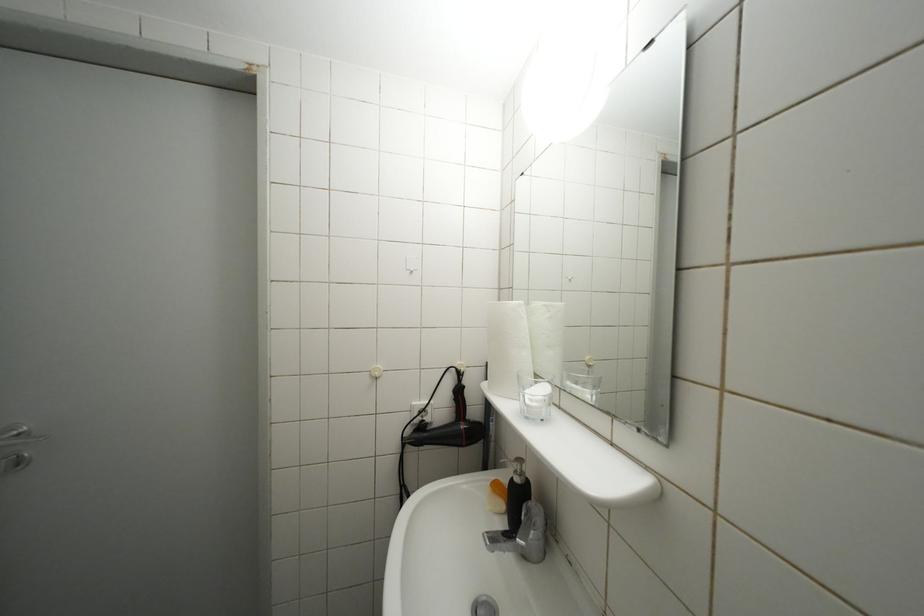
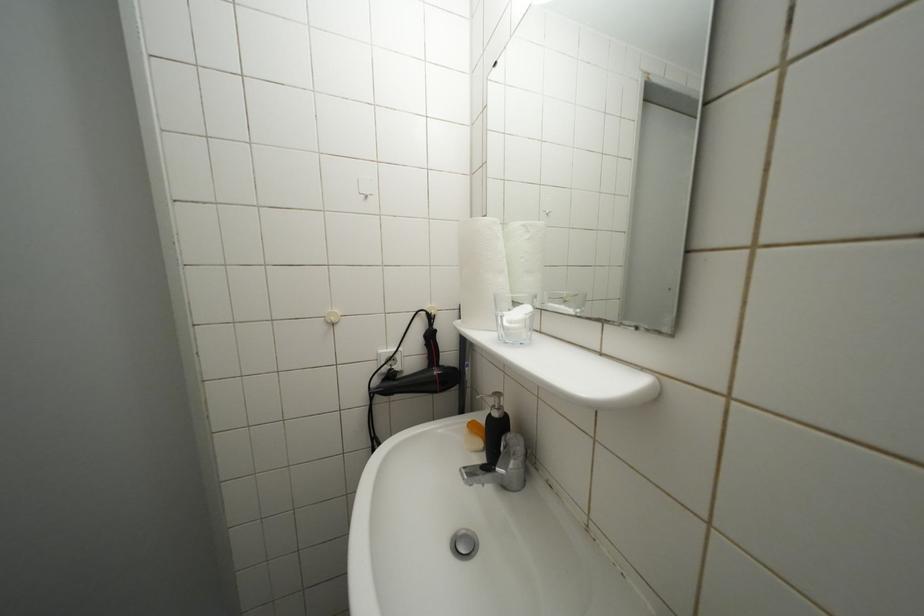
Question: The images are taken continuously from a first-person perspective. In which direction is your viewpoint rotating?

Choices:
 (A) Left
 (B) Right
 (C) Up
 (D) Down

Answer: (D)